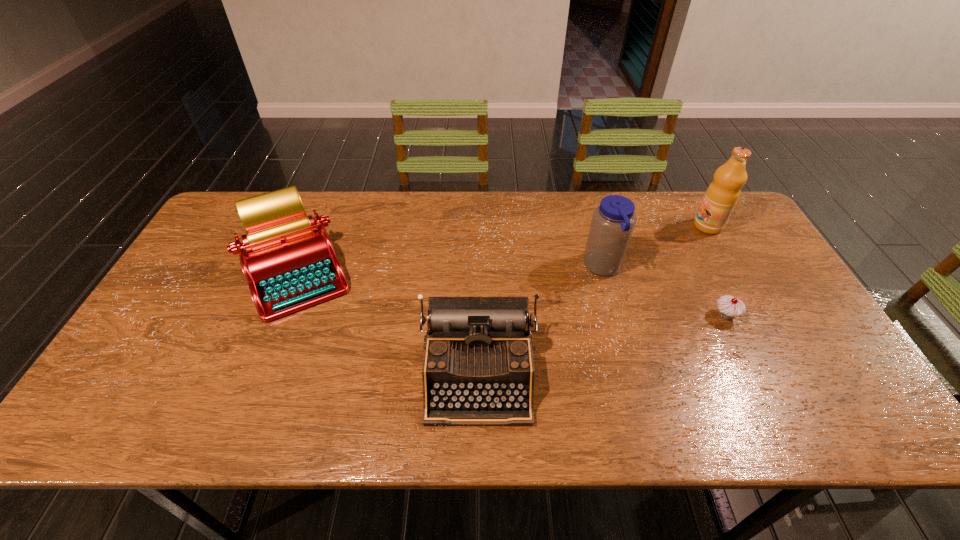
The image size is (960, 540). I want to click on vacant space at the near left corner of the desktop, so click(134, 432).

Identify the location of vacant area between the second tallest object and the cupcake. The image size is (960, 540). (664, 292).

Image resolution: width=960 pixels, height=540 pixels. Find the location of `blank region between the shortest object and the right typewriter`. blank region between the shortest object and the right typewriter is located at coordinates (602, 345).

This screenshot has height=540, width=960. I want to click on free point between the nearest object and the cupcake, so click(x=602, y=345).

Locate an element on the screen. This screenshot has height=540, width=960. vacant space in between the leftmost object and the shortest object is located at coordinates (511, 294).

At what (x,y) coordinates should I click in order to perform the action: click on free space between the nearer typewriter and the fruit juice. Please return your answer as a coordinate pair (x, y). The height and width of the screenshot is (540, 960). Looking at the image, I should click on (593, 300).

This screenshot has height=540, width=960. I want to click on vacant area that lies between the tallest object and the right typewriter, so click(593, 300).

Find the location of a particular element. empty space between the shortest object and the rightmost object is located at coordinates (716, 271).

Image resolution: width=960 pixels, height=540 pixels. Find the location of `free space between the fruit juice and the fourth object from right to left`. free space between the fruit juice and the fourth object from right to left is located at coordinates (593, 300).

I want to click on vacant area between the rightmost object and the cupcake, so click(716, 271).